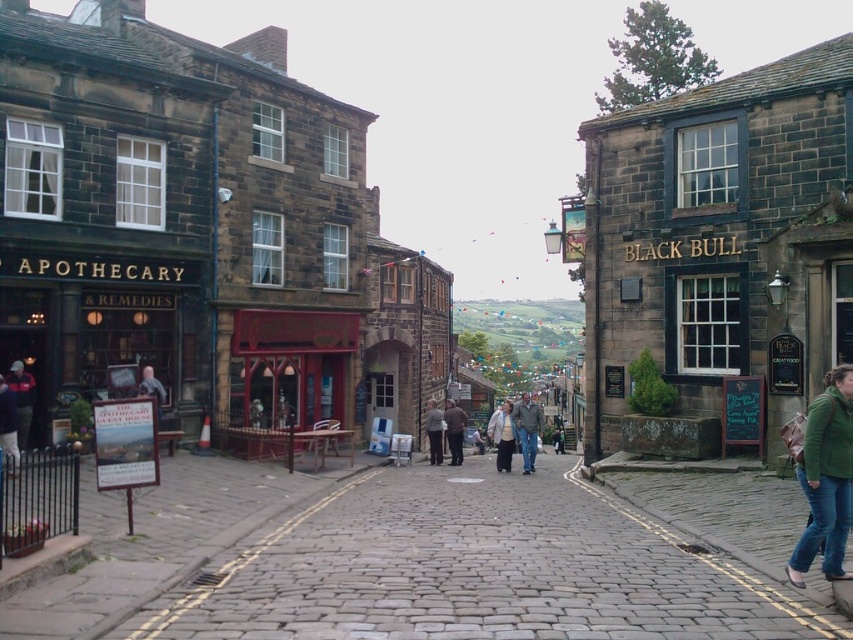
Consider the image. Can you confirm if red wooden shop at center is bigger than dark gray jacket at center?

Yes, red wooden shop at center is bigger than dark gray jacket at center.

Is red wooden shop at center to the right of dark gray jacket at center from the viewer's perspective?

In fact, red wooden shop at center is to the left of dark gray jacket at center.

Locate an element on the screen. red wooden shop at center is located at coordinates (289, 368).

Does point (283, 348) lie behind point (158, 412)?

Yes.

Is red wooden shop at center closer to the viewer compared to blue denim jacket at center?

No, it is not.

Does point (314, 324) come farther from viewer compared to point (157, 380)?

Yes.

The image size is (853, 640). Identify the location of red wooden shop at center. (289, 368).

Is dark gray jacket at center wider than dark gray fabric coat at center?

Incorrect, dark gray jacket at center's width does not surpass dark gray fabric coat at center's.

Which is more to the right, dark gray jacket at center or dark gray fabric coat at center?

dark gray jacket at center is more to the right.

Locate an element on the screen. The image size is (853, 640). dark gray jacket at center is located at coordinates (454, 429).